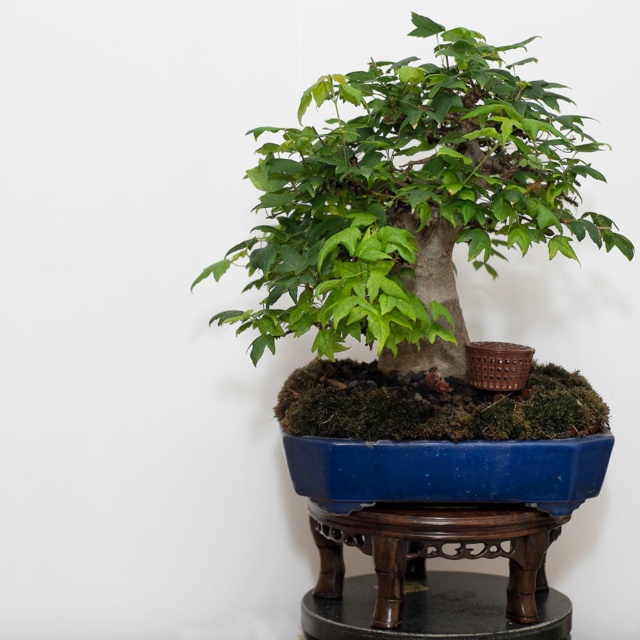
You are a gardener who wants to water the bonsai tree. You see the green matte bonsai tree at center and the wooden stand at center. Which object should you pour water directly onto to ensure proper care?

You should pour water directly onto the green matte bonsai tree at center, as it is the plant requiring hydration. The wooden stand at center supports the pot but does not need watering.

You are a gardener who needs to place a new decorative stone exactly at the center of the bonsai tree. The bonsai tree is at point (x=410, y=198). Where should you place the stone?

The green matte bonsai tree at center is located at point (x=410, y=198), so you should place the stone at that coordinate to center it.